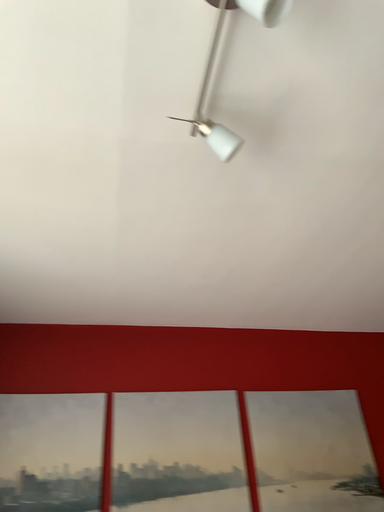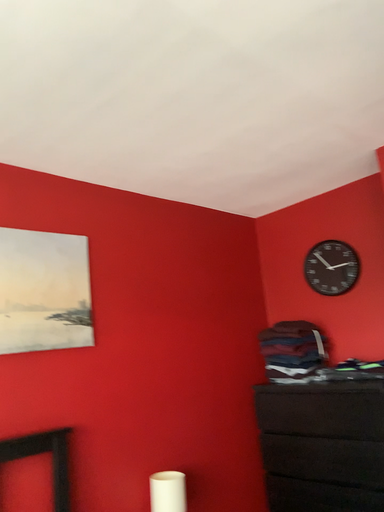
Question: Which way did the camera rotate in the video?

Choices:
 (A) rotated downward
 (B) rotated upward

Answer: (A)